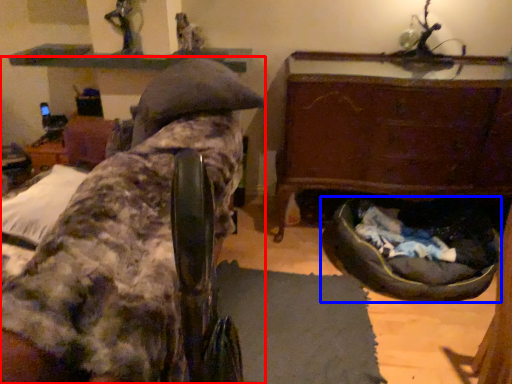
Question: Among these objects, which one is farthest to the camera, furniture (highlighted by a red box) or dog bed (highlighted by a blue box)?

Choices:
 (A) furniture
 (B) dog bed

Answer: (B)